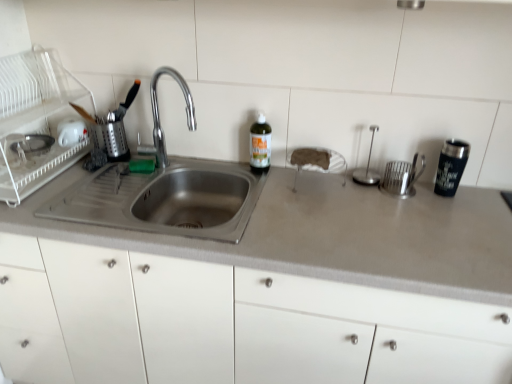
The height and width of the screenshot is (384, 512). Identify the location of free space in front of silver metallic utensil holder at right, which is the 5th appliance from left to right. (418, 214).